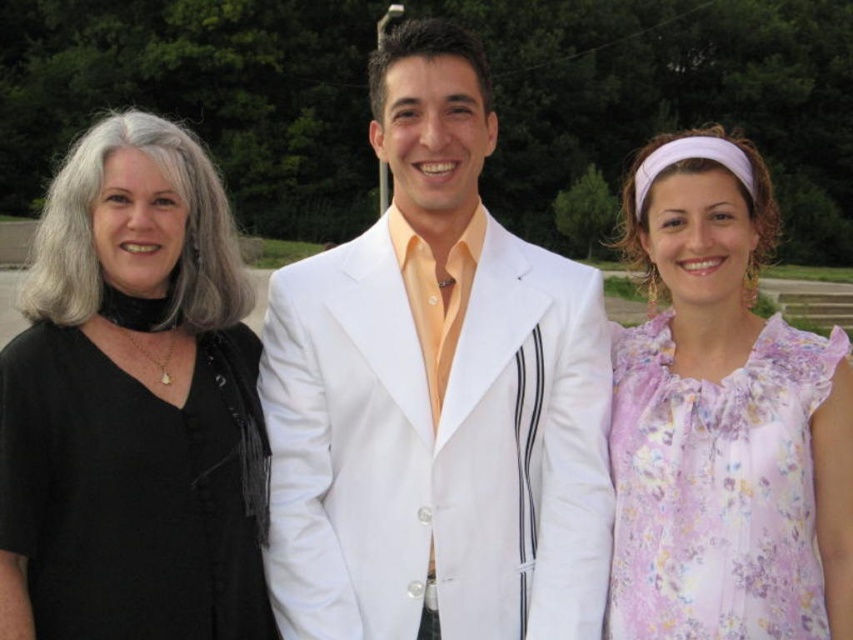
Is white satin suit at center bigger than floral chiffon blouse at right?

No.

Where is `white satin suit at center`? The height and width of the screenshot is (640, 853). white satin suit at center is located at coordinates (436, 396).

The image size is (853, 640). In order to click on white satin suit at center in this screenshot , I will do `click(436, 396)`.

Can you confirm if black matte shirt at left is smaller than floral chiffon blouse at right?

Yes, black matte shirt at left is smaller than floral chiffon blouse at right.

Who is positioned more to the right, black matte shirt at left or floral chiffon blouse at right?

Positioned to the right is floral chiffon blouse at right.

Does point (158, 564) lie in front of point (685, 483)?

Yes, it is in front of point (685, 483).

Find the location of a particular element. The height and width of the screenshot is (640, 853). black matte shirt at left is located at coordinates (129, 403).

Between point (521, 609) and point (245, 545), which one is positioned behind?

The point (521, 609) is more distant.

Which is above, white satin suit at center or black matte shirt at left?

black matte shirt at left is higher up.

Who is more distant from viewer, (389, 493) or (108, 160)?

The point (389, 493) is more distant.

The height and width of the screenshot is (640, 853). What are the coordinates of `white satin suit at center` in the screenshot? It's located at (436, 396).